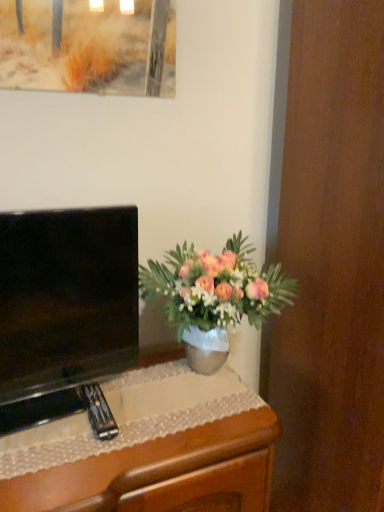
Question: Considering the relative positions of wooden desk at lower left and pink matte vase at center in the image provided, is wooden desk at lower left in front of pink matte vase at center?

Choices:
 (A) yes
 (B) no

Answer: (A)

Question: Does wooden desk at lower left touch pink matte vase at center?

Choices:
 (A) yes
 (B) no

Answer: (B)

Question: Can you confirm if wooden desk at lower left is smaller than pink matte vase at center?

Choices:
 (A) yes
 (B) no

Answer: (B)

Question: From a real-world perspective, is wooden desk at lower left over pink matte vase at center?

Choices:
 (A) yes
 (B) no

Answer: (B)

Question: Is wooden desk at lower left behind pink matte vase at center?

Choices:
 (A) yes
 (B) no

Answer: (B)

Question: From a real-world perspective, is pink matte vase at center positioned above or below black glossy television at left?

Choices:
 (A) above
 (B) below

Answer: (B)

Question: In the image, is pink matte vase at center positioned in front of or behind black glossy television at left?

Choices:
 (A) behind
 (B) front

Answer: (A)

Question: In terms of width, does pink matte vase at center look wider or thinner when compared to black glossy television at left?

Choices:
 (A) wide
 (B) thin

Answer: (A)

Question: Based on their positions, is pink matte vase at center located to the left or right of black glossy television at left?

Choices:
 (A) right
 (B) left

Answer: (A)

Question: Looking at their shapes, would you say wooden desk at lower left is wider or thinner than black glossy television at left?

Choices:
 (A) thin
 (B) wide

Answer: (B)

Question: Is wooden desk at lower left situated inside black glossy television at left or outside?

Choices:
 (A) inside
 (B) outside

Answer: (B)

Question: Is wooden desk at lower left taller or shorter than black glossy television at left?

Choices:
 (A) short
 (B) tall

Answer: (A)

Question: Considering the positions of wooden desk at lower left and black glossy television at left in the image, is wooden desk at lower left bigger or smaller than black glossy television at left?

Choices:
 (A) small
 (B) big

Answer: (B)

Question: Is point (74, 315) positioned closer to the camera than point (193, 321)?

Choices:
 (A) farther
 (B) closer

Answer: (B)

Question: Do you think black glossy television at left is within pink matte vase at center, or outside of it?

Choices:
 (A) inside
 (B) outside

Answer: (B)